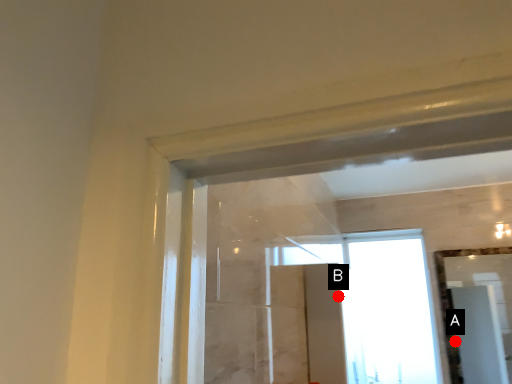
Question: Two points are circled on the image, labeled by A and B beside each circle. Which point is farther from the camera taking this photo?

Choices:
 (A) A is further
 (B) B is further

Answer: (A)